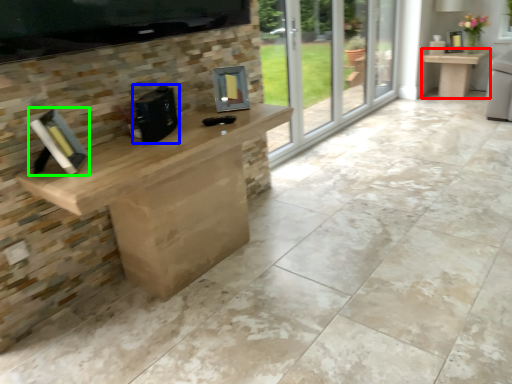
Question: Which is nearer to the table (highlighted by a red box)? appliance (highlighted by a blue box) or book (highlighted by a green box).

Choices:
 (A) appliance
 (B) book

Answer: (A)